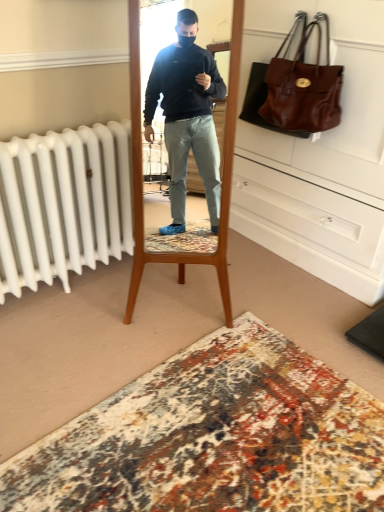
Question: Is brown leather handbag at upper right taller or shorter than matte brown leather dresser at upper right?

Choices:
 (A) short
 (B) tall

Answer: (A)

Question: In terms of width, does brown leather handbag at upper right look wider or thinner when compared to matte brown leather dresser at upper right?

Choices:
 (A) thin
 (B) wide

Answer: (A)

Question: Estimate the real-world distances between objects in this image. Which object is closer to the matte brown leather dresser at upper right?

Choices:
 (A) brown leather handbag at upper right
 (B) carpet with intricate patterns at lower center

Answer: (A)

Question: Based on their relative distances, which object is farther from the carpet with intricate patterns at lower center?

Choices:
 (A) brown leather handbag at upper right
 (B) matte brown leather dresser at upper right

Answer: (A)